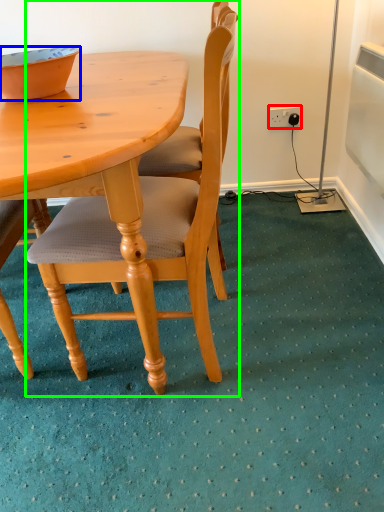
Question: Based on their relative distances, which object is farther from power outlet (highlighted by a red box)? Choose from bowl (highlighted by a blue box) and chair (highlighted by a green box).

Choices:
 (A) bowl
 (B) chair

Answer: (A)